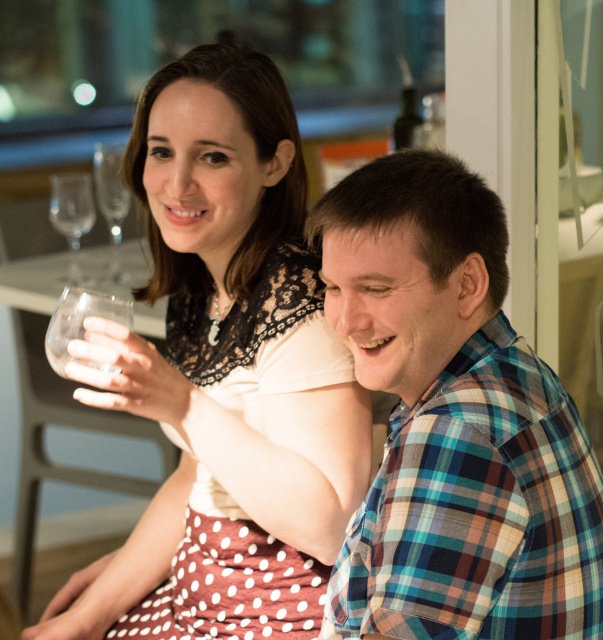
Can you confirm if transparent glass at left is wider than clear glass wine glass at upper left?

No.

Image resolution: width=603 pixels, height=640 pixels. Describe the element at coordinates (72, 216) in the screenshot. I see `transparent glass at left` at that location.

Locate an element on the screen. This screenshot has height=640, width=603. transparent glass at left is located at coordinates (72, 216).

Who is higher up, white lace dress at upper center or clear glass wine glass at upper left?

clear glass wine glass at upper left

Locate an element on the screen. The width and height of the screenshot is (603, 640). white lace dress at upper center is located at coordinates (223, 360).

At what (x,y) coordinates should I click in order to perform the action: click on white lace dress at upper center. Please return your answer as a coordinate pair (x, y). This screenshot has height=640, width=603. Looking at the image, I should click on (223, 360).

Where is `white lace dress at upper center`? The height and width of the screenshot is (640, 603). white lace dress at upper center is located at coordinates (223, 360).

Can you confirm if white lace dress at upper center is positioned below transparent glass at left?

Yes, white lace dress at upper center is below transparent glass at left.

Is white lace dress at upper center thinner than transparent glass at left?

Incorrect, white lace dress at upper center's width is not less than transparent glass at left's.

Measure the distance between white lace dress at upper center and camera.

white lace dress at upper center is 3.73 feet from camera.

The height and width of the screenshot is (640, 603). Find the location of `white lace dress at upper center`. white lace dress at upper center is located at coordinates (223, 360).